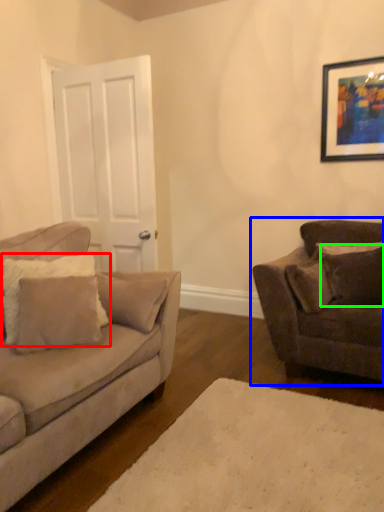
Question: Based on their relative distances, which object is farther from pillow (highlighted by a red box)? Choose from studio couch (highlighted by a blue box) and pillow (highlighted by a green box).

Choices:
 (A) studio couch
 (B) pillow

Answer: (B)